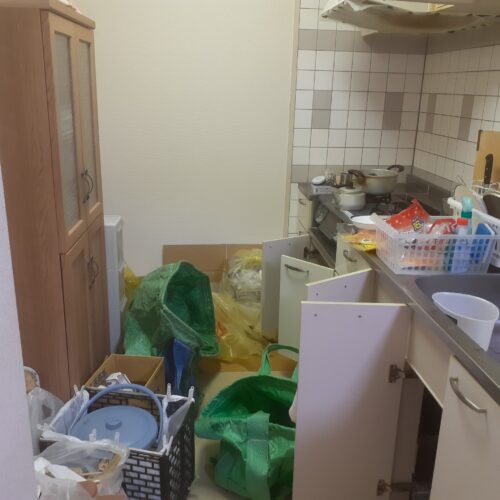
At what (x,y) coordinates should I click in order to perform the action: click on trash bag. Please return your answer as a coordinate pair (x, y). The image size is (500, 500). Looking at the image, I should click on (242, 278).